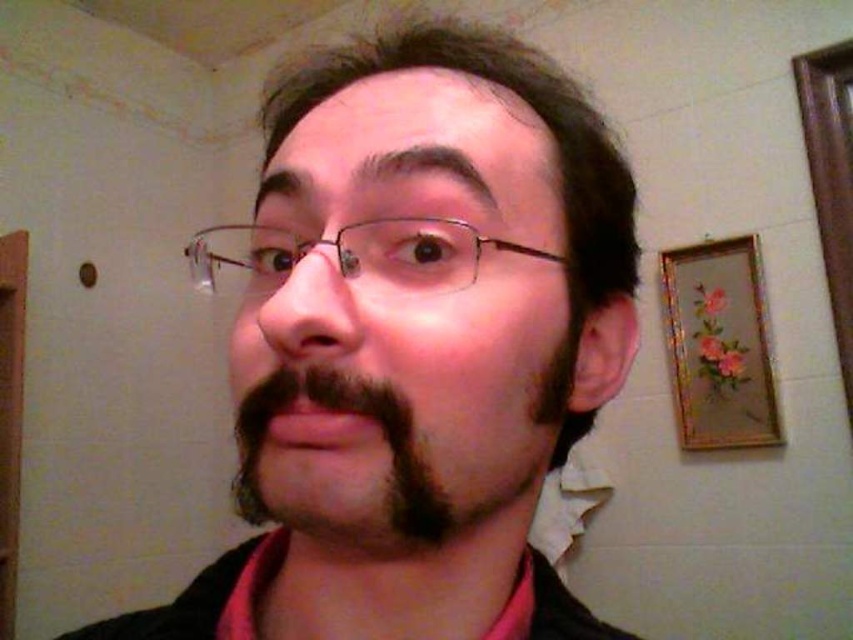
You are an artist sketching this person. You need to decide the order to draw elements so that taller objects are sketched first. Which should you draw first, the matte black hair at center or the metallic wireframe glasses at center?

The matte black hair at center is taller than the metallic wireframe glasses at center, so you should draw the matte black hair at center first.